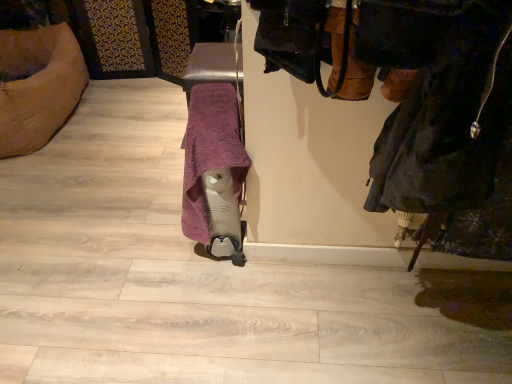
Question: In terms of size, does purple soft towel at center appear bigger or smaller than dark gray fabric coat at right?

Choices:
 (A) small
 (B) big

Answer: (B)

Question: Is point (199, 87) positioned closer to the camera than point (338, 64)?

Choices:
 (A) closer
 (B) farther

Answer: (B)

Question: Considering their positions, is purple soft towel at center located in front of or behind dark gray fabric coat at right?

Choices:
 (A) behind
 (B) front

Answer: (A)

Question: Considering the positions of dark gray fabric coat at right and purple soft towel at center in the image, is dark gray fabric coat at right wider or thinner than purple soft towel at center?

Choices:
 (A) thin
 (B) wide

Answer: (B)

Question: From the image's perspective, is dark gray fabric coat at right positioned above or below purple soft towel at center?

Choices:
 (A) above
 (B) below

Answer: (A)

Question: Is dark gray fabric coat at right spatially inside purple soft towel at center, or outside of it?

Choices:
 (A) outside
 (B) inside

Answer: (A)

Question: Considering the relative positions of dark gray fabric coat at right and purple soft towel at center in the image provided, is dark gray fabric coat at right to the left or to the right of purple soft towel at center?

Choices:
 (A) right
 (B) left

Answer: (A)